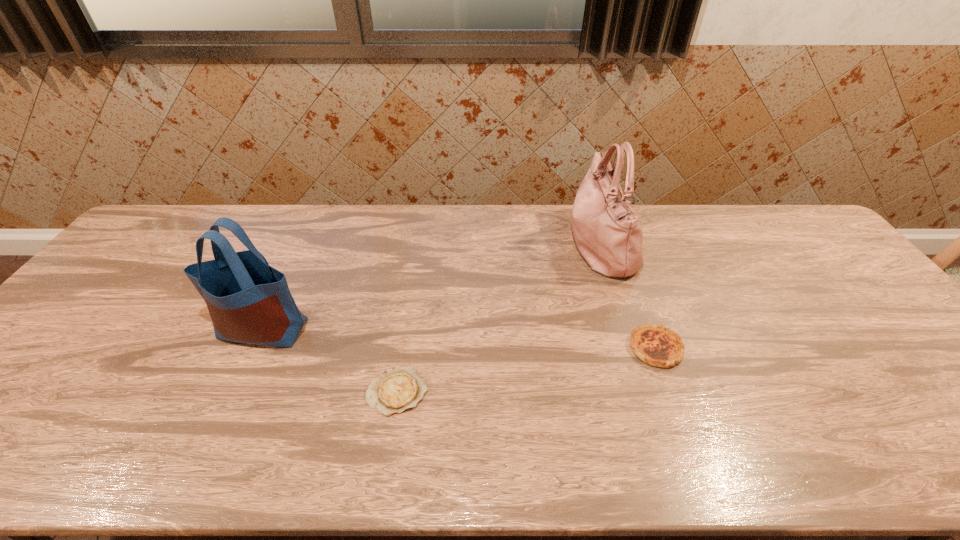
Find the location of a particular element. The width and height of the screenshot is (960, 540). the farther handbag is located at coordinates (608, 235).

Locate an element on the screen. Image resolution: width=960 pixels, height=540 pixels. the right handbag is located at coordinates (608, 235).

At what (x,y) coordinates should I click in order to perform the action: click on the left handbag. Please return your answer as a coordinate pair (x, y). The image size is (960, 540). Looking at the image, I should click on (249, 302).

Identify the location of the leftmost object. (249, 302).

The width and height of the screenshot is (960, 540). Identify the location of the third tallest object. (658, 346).

You are a GUI agent. You are given a task and a screenshot of the screen. Output one action in this format:
    pyautogui.click(x=<x>, y=<y>)
    Task: Click on the taller quiche
    The height and width of the screenshot is (540, 960).
    Given the screenshot: What is the action you would take?
    pyautogui.click(x=658, y=346)

Find the location of a particular element. The height and width of the screenshot is (540, 960). the left quiche is located at coordinates (398, 389).

This screenshot has height=540, width=960. In order to click on the shorter quiche in this screenshot , I will do `click(398, 389)`.

Locate an element on the screen. Image resolution: width=960 pixels, height=540 pixels. free space located at the front of the right handbag with handles is located at coordinates (513, 244).

The width and height of the screenshot is (960, 540). Identify the location of free space located 0.160m at the front of the right handbag with handles. (518, 244).